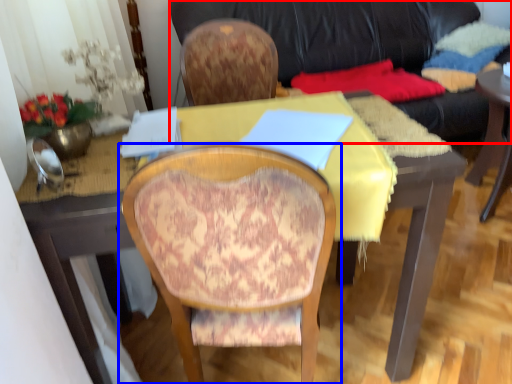
Question: Which point is further to the camera, studio couch (highlighted by a red box) or chair (highlighted by a blue box)?

Choices:
 (A) studio couch
 (B) chair

Answer: (A)